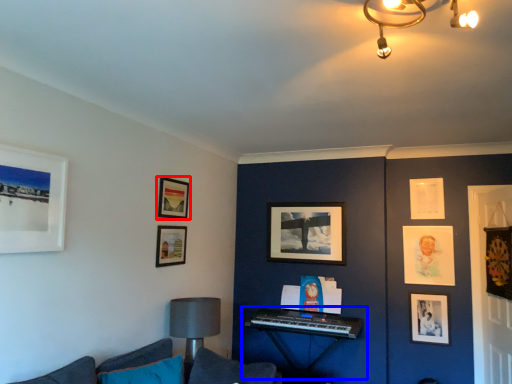
Question: Among these objects, which one is nearest to the camera, picture frame (highlighted by a red box) or piano (highlighted by a blue box)?

Choices:
 (A) picture frame
 (B) piano

Answer: (A)